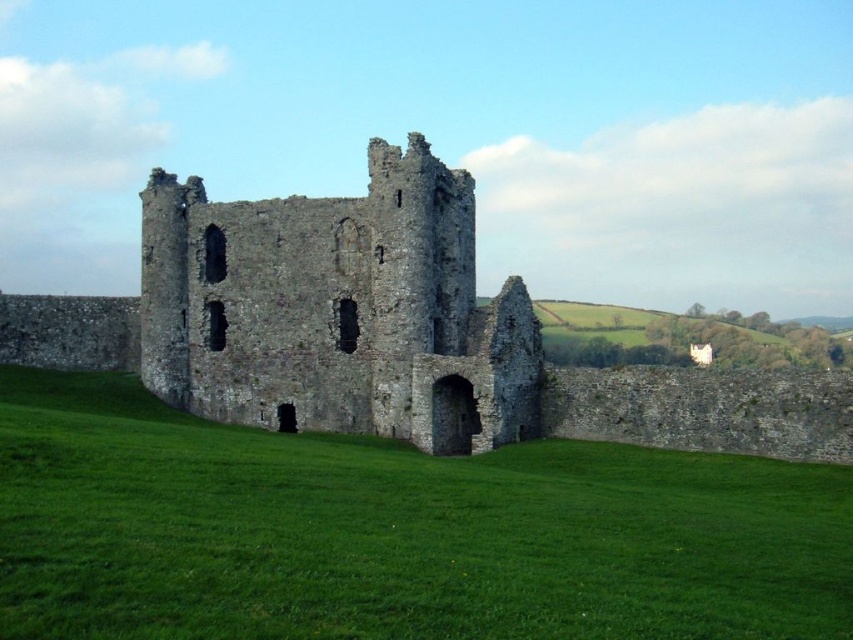
Question: Can you confirm if green grassy at center is bigger than stone castle at center?

Choices:
 (A) yes
 (B) no

Answer: (B)

Question: Does green grassy at center appear under stone castle at center?

Choices:
 (A) no
 (B) yes

Answer: (B)

Question: Does green grassy at center lie behind stone castle at center?

Choices:
 (A) yes
 (B) no

Answer: (B)

Question: Which of the following is the closest to the observer?

Choices:
 (A) pos(735,566)
 (B) pos(152,237)

Answer: (A)